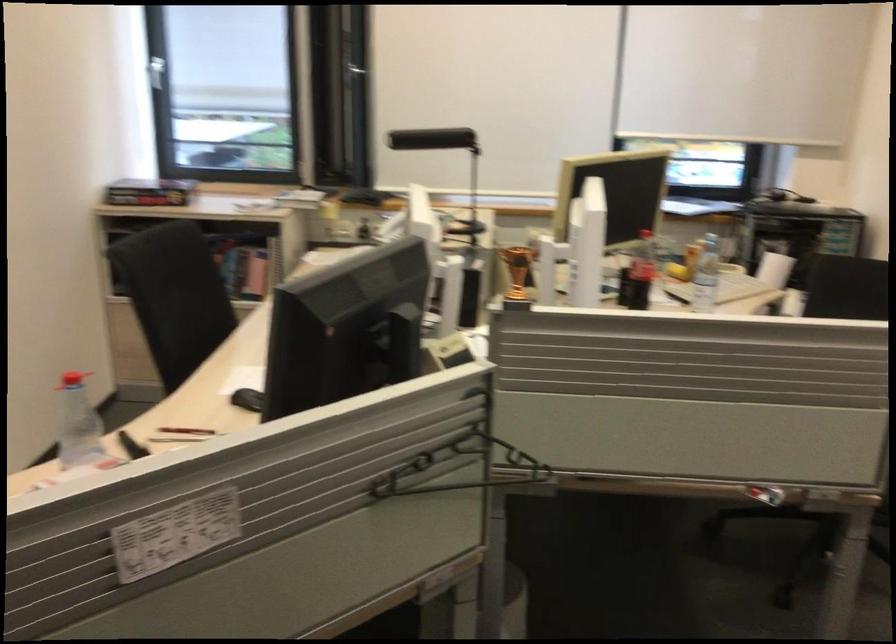
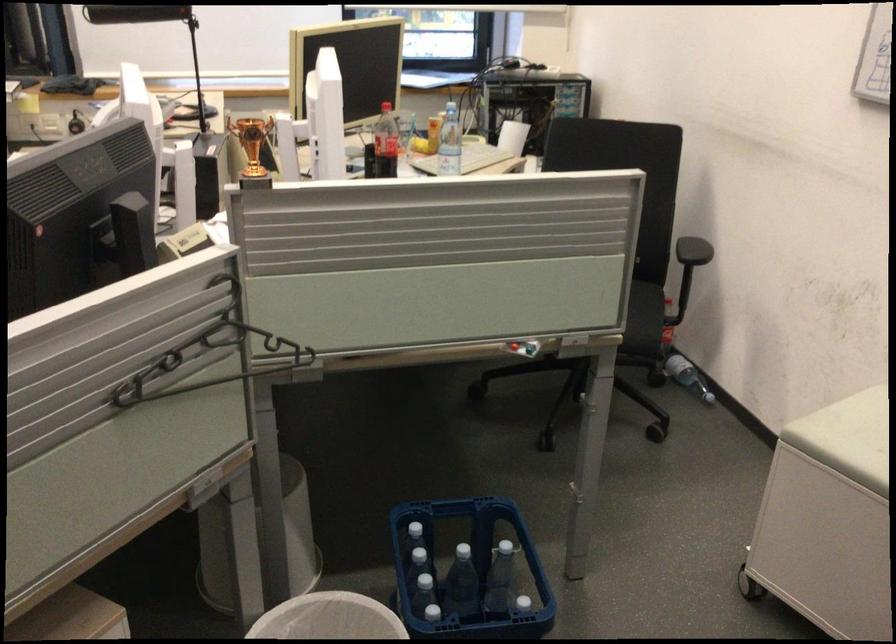
The point at (455, 460) is marked in the first image. Where is the corresponding point in the second image?

(209, 355)